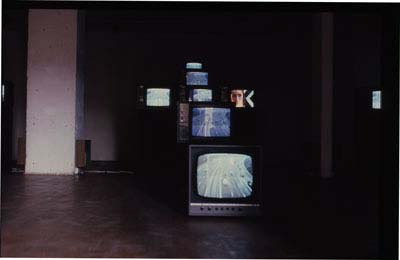
Where is `tv's`? This screenshot has height=260, width=400. tv's is located at coordinates (221, 176), (217, 120), (199, 93), (192, 79), (194, 66), (161, 95), (236, 95).